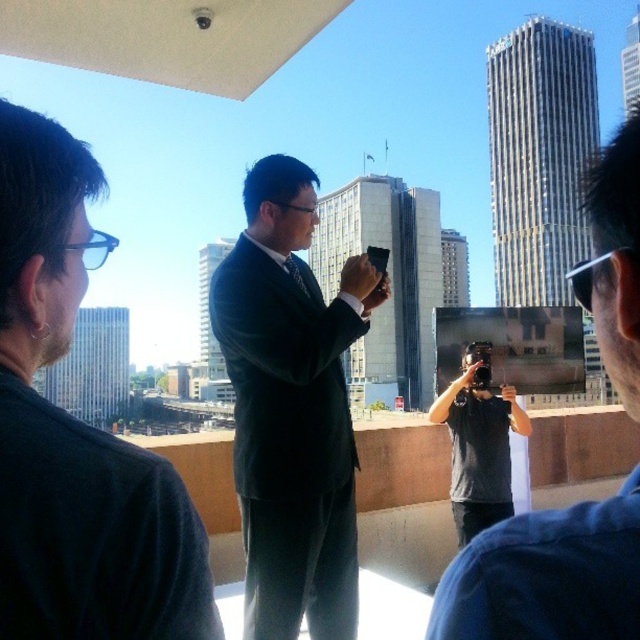
Question: Does dark blue suit at center appear under dark gray shirt at center?

Choices:
 (A) yes
 (B) no

Answer: (A)

Question: Estimate the real-world distances between objects in this image. Which object is farther from the black matte suit at center?

Choices:
 (A) dark gray shirt at center
 (B) dark blue suit at center
 (C) gray fabric camera at center

Answer: (C)

Question: Which point is closer to the camera taking this photo?

Choices:
 (A) (296, 618)
 (B) (456, 385)

Answer: (A)

Question: Is dark gray shirt at center thinner than gray fabric camera at center?

Choices:
 (A) yes
 (B) no

Answer: (B)

Question: Which object appears closest to the camera in this image?

Choices:
 (A) dark blue suit at center
 (B) gray fabric camera at center
 (C) dark gray shirt at center

Answer: (C)

Question: Is dark blue suit at center to the left of dark gray shirt at center from the viewer's perspective?

Choices:
 (A) yes
 (B) no

Answer: (A)